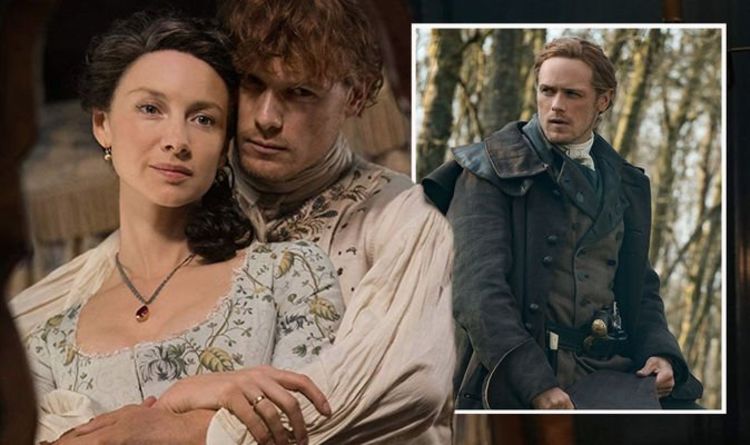
This screenshot has width=750, height=445. I want to click on pendant, so point(142,316).